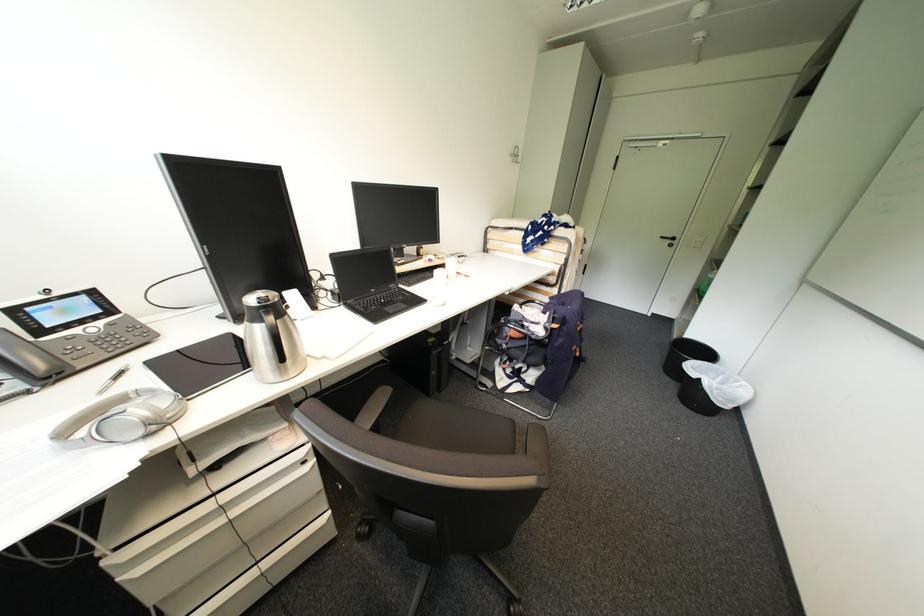
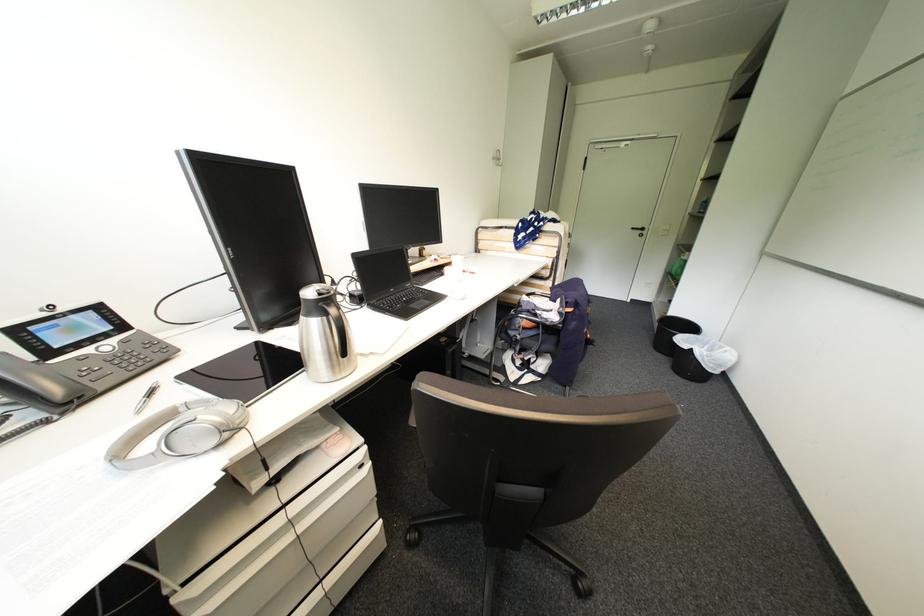
Where in the second image is the point corresponding to (x=274, y=314) from the first image?

(334, 306)